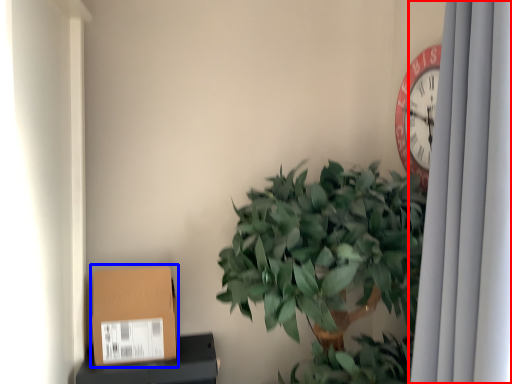
Question: Among these objects, which one is nearest to the camera, curtain (highlighted by a red box) or cardboard box (highlighted by a blue box)?

Choices:
 (A) curtain
 (B) cardboard box

Answer: (A)